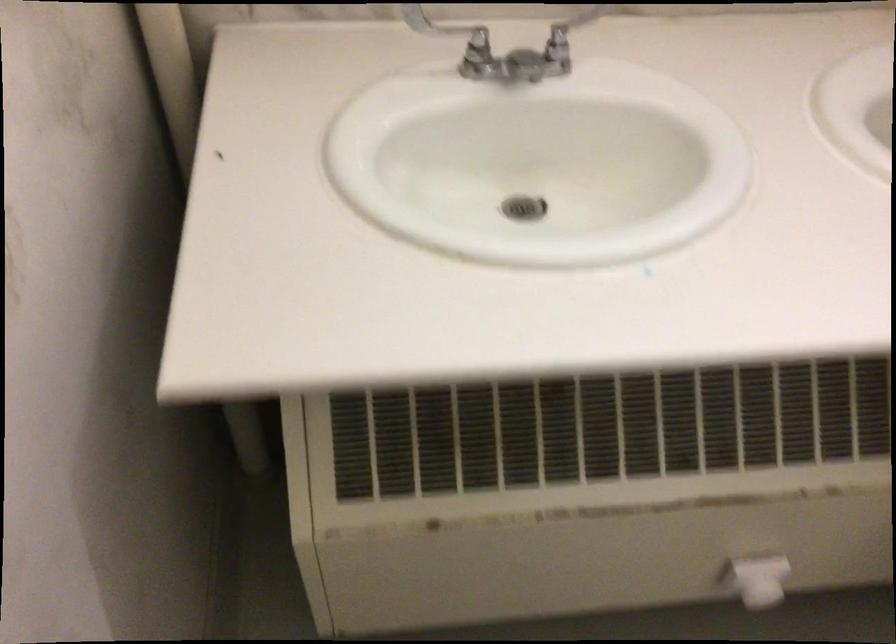
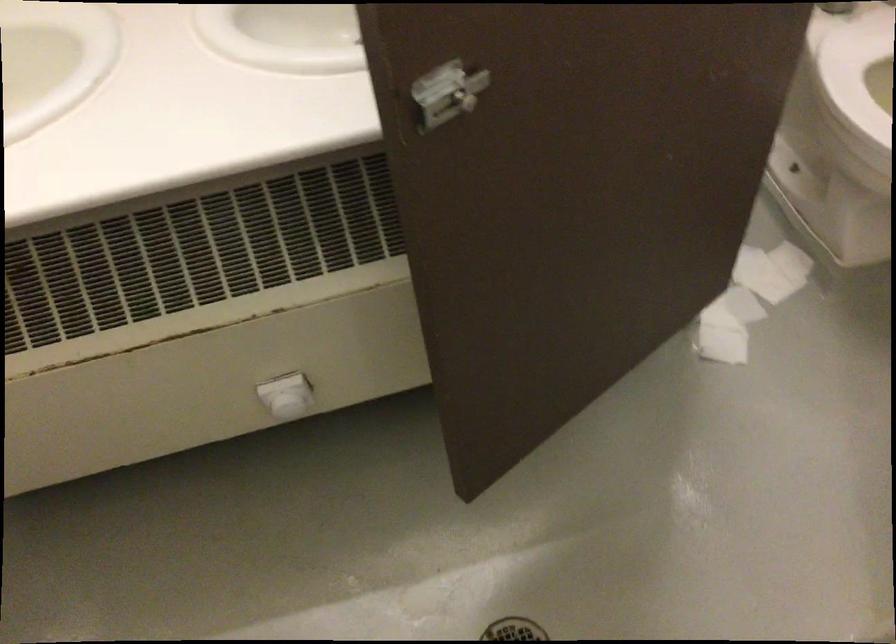
Question: Based on the continuous images, in which direction is the camera rotating? Reply with the corresponding letter.

Choices:
 (A) Left
 (B) Right
 (C) Up
 (D) Down

Answer: (D)